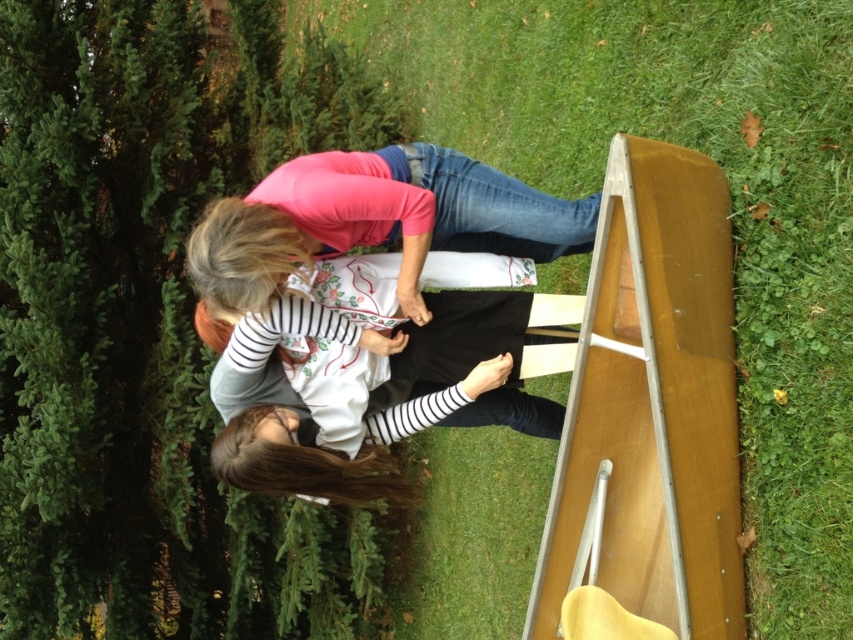
Can you confirm if green grass at lower right is positioned to the left of wooden ramp at lower right?

Yes, green grass at lower right is to the left of wooden ramp at lower right.

Is point (799, 342) closer to viewer compared to point (705, 570)?

Yes.

Between point (659, 17) and point (689, 488), which one is positioned behind?

The point (659, 17) is more distant.

Image resolution: width=853 pixels, height=640 pixels. I want to click on green grass at lower right, so 730,209.

Can you confirm if green grass at lower right is shorter than pink matte shirt at center?

No.

Where is `green grass at lower right`? The image size is (853, 640). green grass at lower right is located at coordinates (730, 209).

At what (x,y) coordinates should I click in order to perform the action: click on green grass at lower right. Please return your answer as a coordinate pair (x, y). The image size is (853, 640). Looking at the image, I should click on (730, 209).

Who is shorter, wooden ramp at lower right or pink matte shirt at center?

pink matte shirt at center

What do you see at coordinates (653, 404) in the screenshot? This screenshot has height=640, width=853. I see `wooden ramp at lower right` at bounding box center [653, 404].

Where is `wooden ramp at lower right`? wooden ramp at lower right is located at coordinates (653, 404).